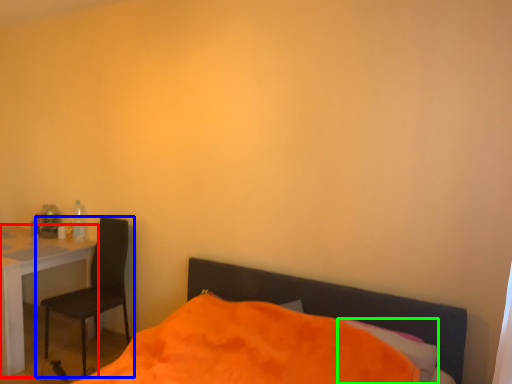
Question: Considering the real-world distances, which object is closest to desk (highlighted by a red box)? chair (highlighted by a blue box) or pillow (highlighted by a green box).

Choices:
 (A) chair
 (B) pillow

Answer: (A)